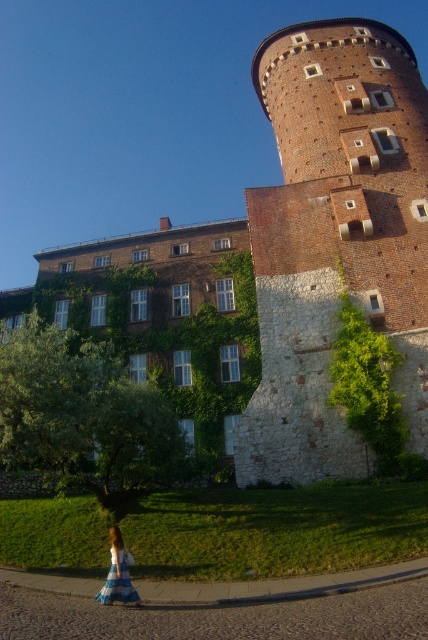
Question: Can you confirm if brick tower at center is positioned to the right of brown brick tower at center?

Choices:
 (A) yes
 (B) no

Answer: (B)

Question: Estimate the real-world distances between objects in this image. Which object is farther from the blue plaid dress at lower left?

Choices:
 (A) brown brick tower at center
 (B) brick tower at center

Answer: (A)

Question: Which point is closer to the camera taking this photo?

Choices:
 (A) [x=416, y=410]
 (B) [x=288, y=33]
 (C) [x=107, y=595]

Answer: (C)

Question: Can you confirm if brick tower at center is positioned to the right of brown brick tower at center?

Choices:
 (A) yes
 (B) no

Answer: (B)

Question: Which object appears closest to the camera in this image?

Choices:
 (A) brick tower at center
 (B) blue plaid dress at lower left

Answer: (B)

Question: Can you confirm if brick tower at center is wider than blue plaid dress at lower left?

Choices:
 (A) no
 (B) yes

Answer: (B)